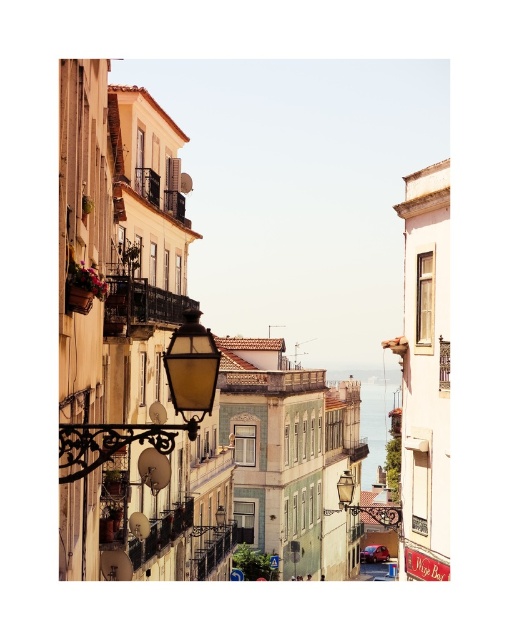
Question: Which object is closer to the camera taking this photo?

Choices:
 (A) rustic wrought iron balcony at center-left
 (B) rustic wood balcony at center-left
 (C) matte black streetlamp at center

Answer: (A)

Question: Is matte brass streetlamp at center-left thinner than rustic wood balcony at center-left?

Choices:
 (A) no
 (B) yes

Answer: (A)

Question: Is matte brass streetlamp at center-left to the right of rustic wood balcony at center-left from the viewer's perspective?

Choices:
 (A) no
 (B) yes

Answer: (B)

Question: Which point appears closest to the camera in this image?

Choices:
 (A) (376, 426)
 (B) (121, 310)
 (C) (69, 442)
 (D) (126, 182)

Answer: (C)

Question: Which of these objects is positioned farthest from the matte brass streetlamp at center-left?

Choices:
 (A) clear blue water at center
 (B) matte black streetlamp at center

Answer: (A)

Question: Is matte brass streetlamp at center-left thinner than rustic wood balcony at center-left?

Choices:
 (A) no
 (B) yes

Answer: (A)